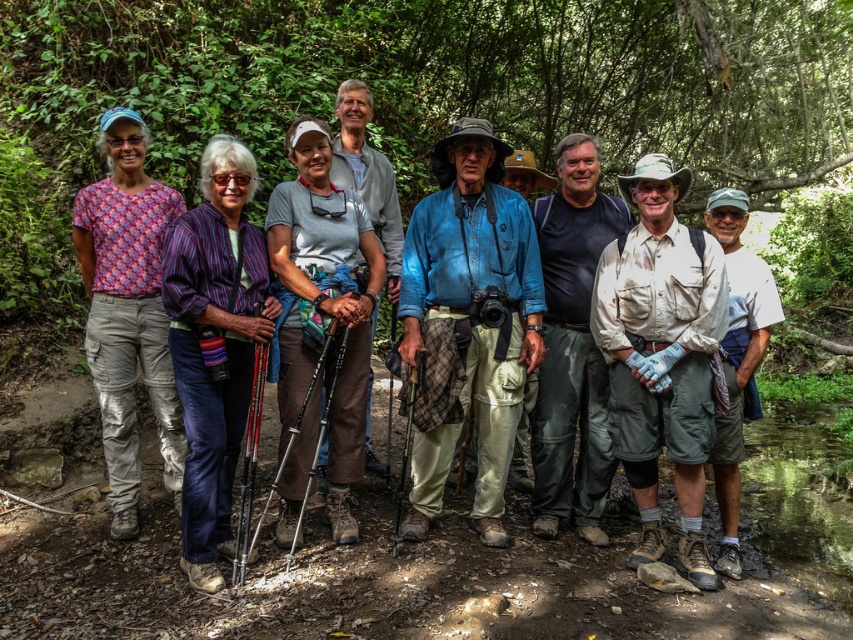
Who is taller, matte purple shirt at center or denim shirt at center?

Standing taller between the two is denim shirt at center.

Which is below, matte purple shirt at center or denim shirt at center?

Positioned lower is matte purple shirt at center.

Does point (247, 173) come farther from viewer compared to point (468, 212)?

No, (247, 173) is in front of (468, 212).

Image resolution: width=853 pixels, height=640 pixels. Find the location of `matte purple shirt at center`. matte purple shirt at center is located at coordinates (474, 250).